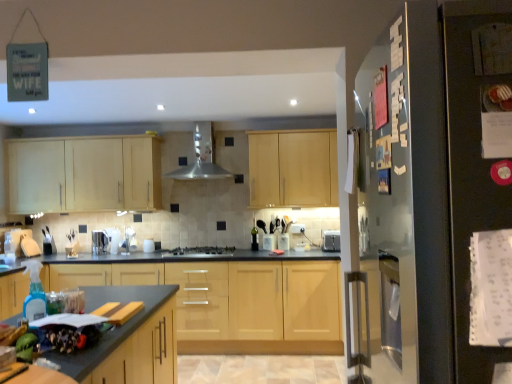
Question: Is light wood cabinet at upper left, positioned as the second cabinetry in bottom-to-top order, inside or outside of light wood cabinet at center, which is the first cabinetry in top-to-bottom order?

Choices:
 (A) inside
 (B) outside

Answer: (B)

Question: In the image, is light wood cabinet at upper left, positioned as the second cabinetry in bottom-to-top order, on the left side or the right side of light wood cabinet at center, marked as the third cabinetry in a bottom-to-top arrangement?

Choices:
 (A) right
 (B) left

Answer: (B)

Question: Estimate the real-world distances between objects in this image. Which object is farther from the satin silver toaster at center, the 2th appliance in the left-to-right sequence?

Choices:
 (A) light wood cabinet at upper left, positioned as the second cabinetry in bottom-to-top order
 (B) light wood cabinet at center, which is the first cabinetry in top-to-bottom order
 (C) satin silver toaster at center, which ranks as the 1th appliance in left-to-right order
 (D) satin silver gas stove at center
 (E) black matte refrigerator at right

Answer: (E)

Question: Which is nearer to the satin silver exhaust hood at center?

Choices:
 (A) black matte refrigerator at right
 (B) light wood cabinet at center, which is the 1th cabinetry from bottom to top
 (C) satin silver gas stove at center
 (D) satin silver toaster at center, acting as the 1th appliance starting from the right
 (E) light wood cabinet at upper left, which appears as the second cabinetry when viewed from the top

Answer: (E)